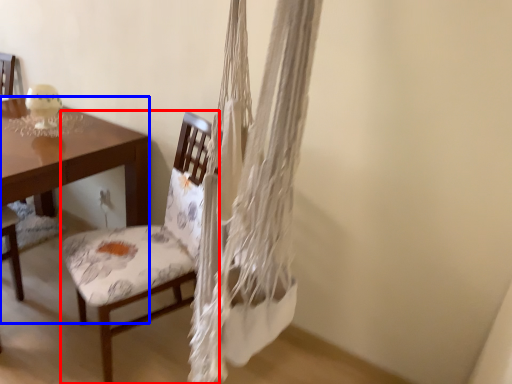
Question: Among these objects, which one is farthest to the camera, chair (highlighted by a red box) or desk (highlighted by a blue box)?

Choices:
 (A) chair
 (B) desk

Answer: (B)